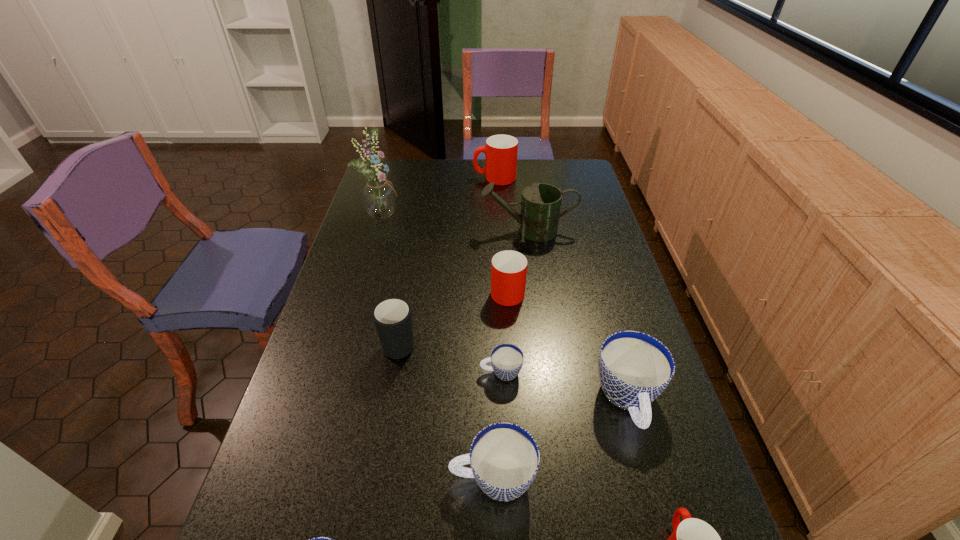
The image size is (960, 540). I want to click on vacant region located 0.230m on the side of the smallest blue cup with the handle, so click(x=390, y=373).

You are a GUI agent. You are given a task and a screenshot of the screen. Output one action in this format:
    pyautogui.click(x=<x>, y=<y>)
    Task: Click on the free location located 0.160m on the side of the smallest blue cup with the handle
    
    Given the screenshot: What is the action you would take?
    pyautogui.click(x=418, y=373)

The width and height of the screenshot is (960, 540). Find the location of `vacant area situated on the side of the smallest blue cup with the handle`. vacant area situated on the side of the smallest blue cup with the handle is located at coordinates (394, 373).

Identify the location of object that is at the far edge. This screenshot has height=540, width=960. (500, 151).

Locate an element on the screen. The height and width of the screenshot is (540, 960). object that is at the left edge is located at coordinates (379, 199).

Find the location of a particular element. The image size is (960, 540). watering can situated at the right edge is located at coordinates (540, 207).

At what (x,y) coordinates should I click in order to perform the action: click on cup that is positioned at the right edge. Please return your answer as a coordinate pair (x, y). The image size is (960, 540). Looking at the image, I should click on (635, 368).

Identify the location of vacant space at the far edge of the desktop. (461, 167).

Where is `vacant space at the left edge of the desktop`? This screenshot has width=960, height=540. vacant space at the left edge of the desktop is located at coordinates (x=347, y=313).

Where is `vacant space at the right edge of the desktop`? vacant space at the right edge of the desktop is located at coordinates (639, 311).